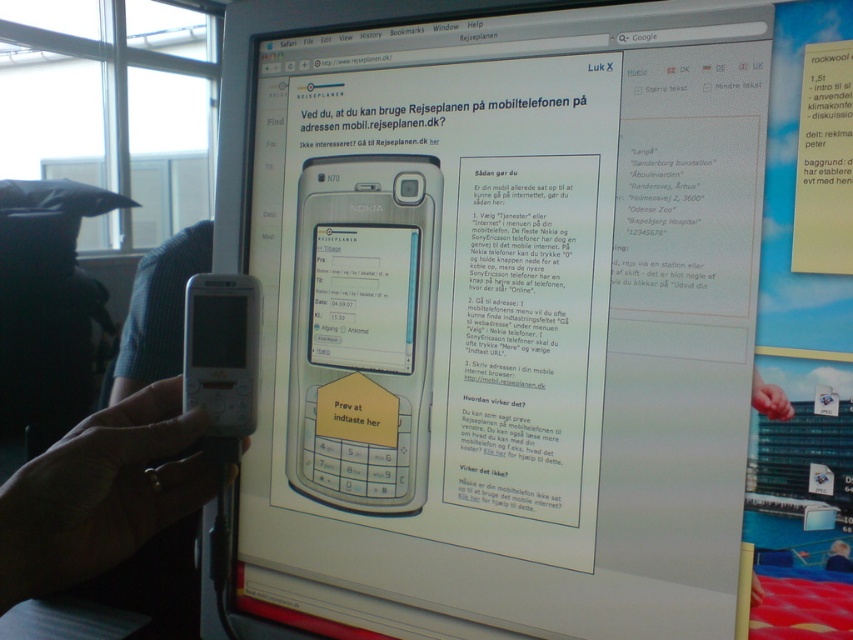
Question: Is silver metallic phone at center bigger than gray matte phone at center?

Choices:
 (A) no
 (B) yes

Answer: (A)

Question: Which object is positioned farthest from the skinny white hand at lower right?

Choices:
 (A) white matte phone at lower left
 (B) matte black phone at center

Answer: (A)

Question: Considering the relative positions of matte black phone at center and skinny white hand at lower right in the image provided, where is matte black phone at center located with respect to skinny white hand at lower right?

Choices:
 (A) below
 (B) above

Answer: (B)

Question: Which object is closer to the camera taking this photo?

Choices:
 (A) white matte phone at lower left
 (B) yellow paper note at upper right

Answer: (A)

Question: Estimate the real-world distances between objects in this image. Which object is closer to the gray matte phone at center?

Choices:
 (A) skinny white hand at lower right
 (B) matte black phone at center
 (C) silver metallic phone at center

Answer: (C)

Question: Does yellow paper note at upper right have a larger size compared to skinny white hand at lower right?

Choices:
 (A) yes
 (B) no

Answer: (A)